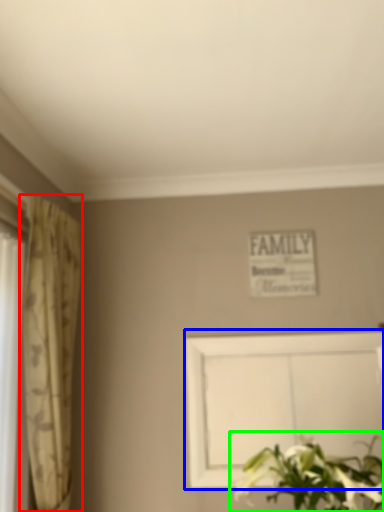
Question: Based on their relative distances, which object is farther from curtain (highlighted by a red box)? Choose from picture frame (highlighted by a blue box) and floral arrangement (highlighted by a green box).

Choices:
 (A) picture frame
 (B) floral arrangement

Answer: (B)